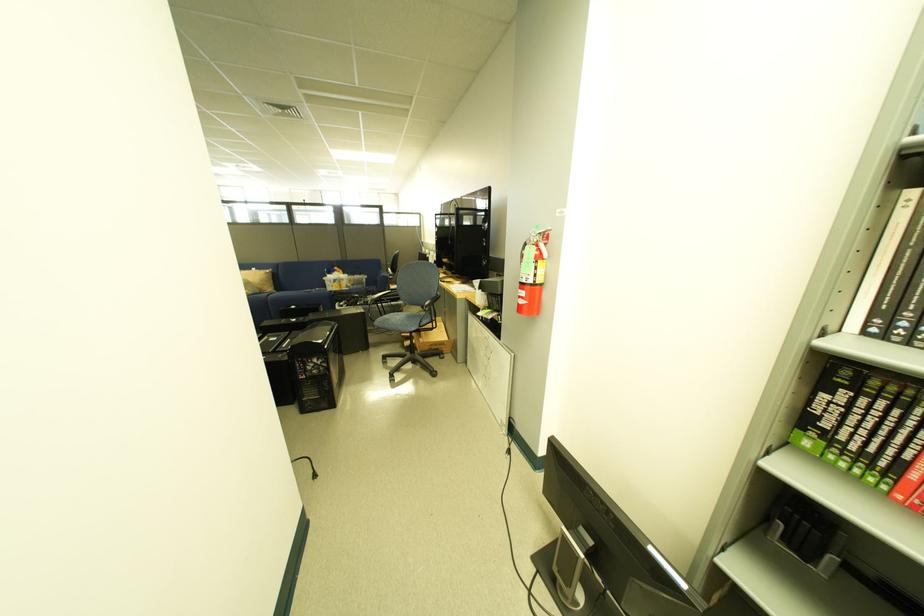
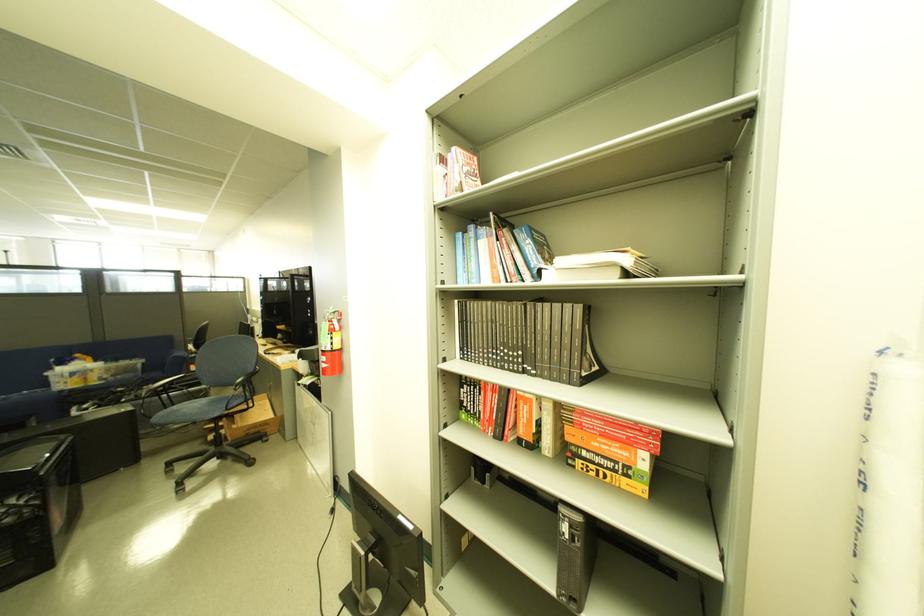
In the second image, find the point that corresponds to (x=372, y=300) in the first image.

(142, 392)